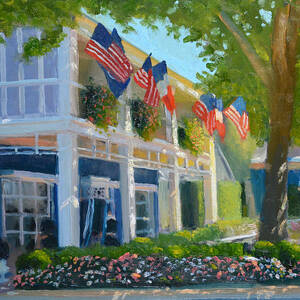
Locate an element on the screen. The width and height of the screenshot is (300, 300). pillars is located at coordinates coord(74,193), coord(127,198), coord(176,215), coord(210,207).